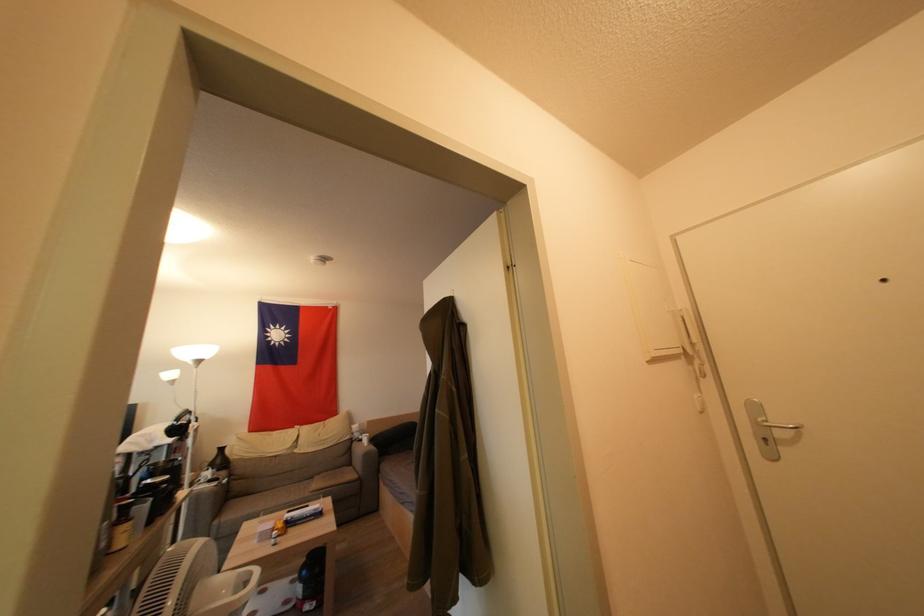
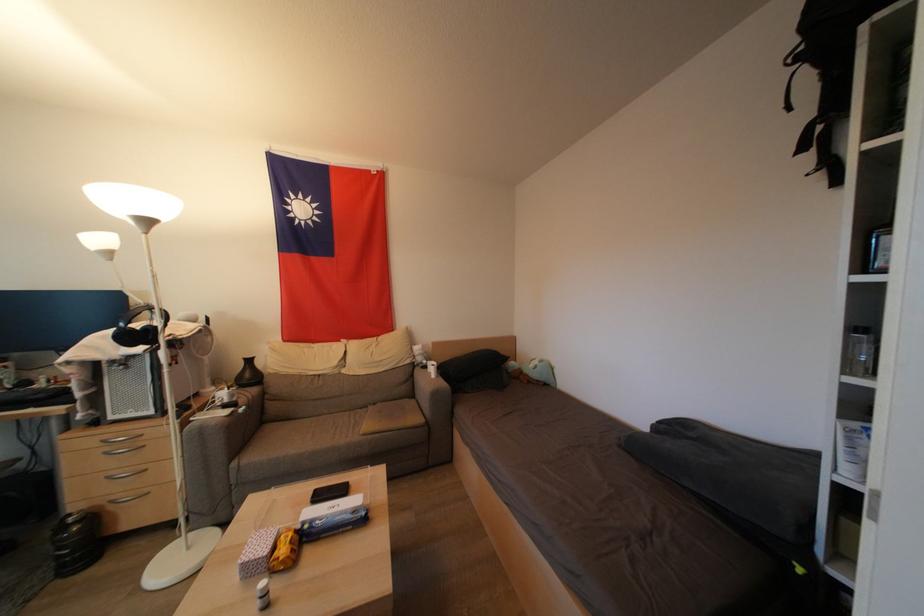
The point at (294,528) is marked in the first image. Where is the corresponding point in the second image?

(310, 541)